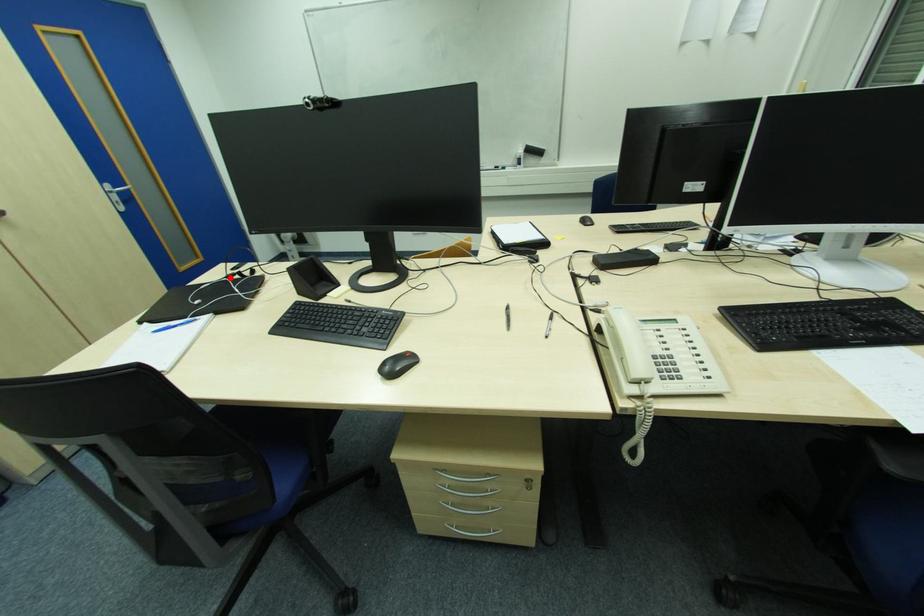
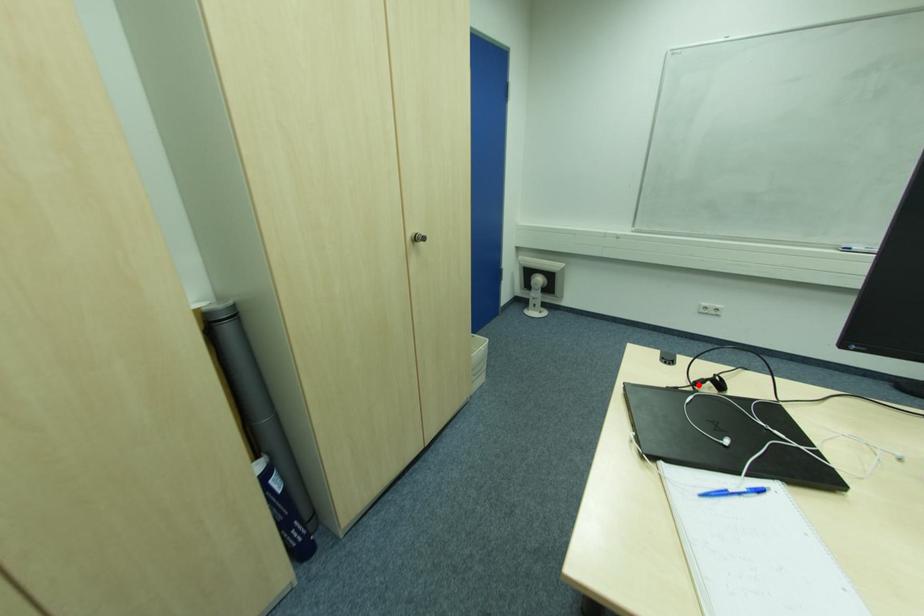
I am providing you with two images of the same scene from different viewpoints. A red point is marked on the first image and another point is marked on the second image. Do the highlighted points in image1 and image2 indicate the same real-world spot?

Yes